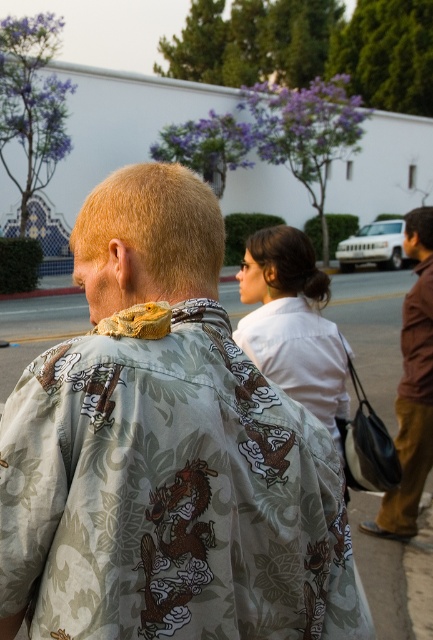
You are a photographer trying to capture a clear shot of the printed fabric shirt at center and the brown leather bag at right. Which object should you focus on first to ensure both are in focus?

The printed fabric shirt at center is closer to the viewer than the brown leather bag at right, so you should focus on the printed fabric shirt at center first to ensure both are in focus.

You are a photographer standing in front of the printed fabric shirt at center. You want to take a closeup shot of it. The camera you are using has a minimum focusing distance of 1 meter. Will you be able to take the photo without moving closer?

The printed fabric shirt at center is 1.12 meters from camera, so yes, you can take the photo without moving closer because the distance is within the camera minimum focusing distance of 1 meter.